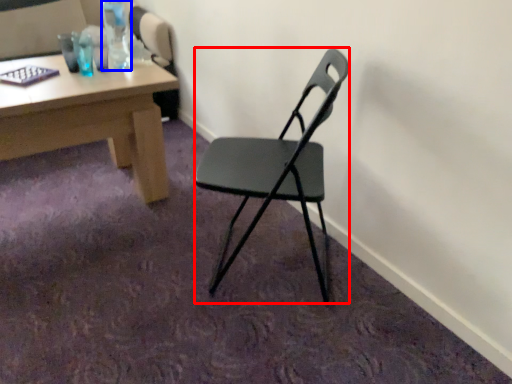
Question: Which of the following is the closest to the observer, chair (highlighted by a red box) or bottle (highlighted by a blue box)?

Choices:
 (A) chair
 (B) bottle

Answer: (A)